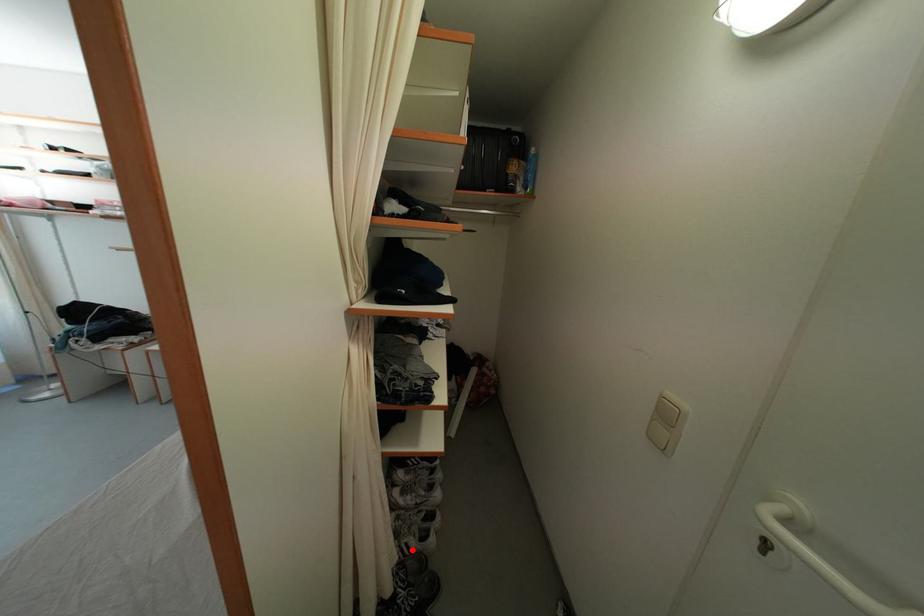
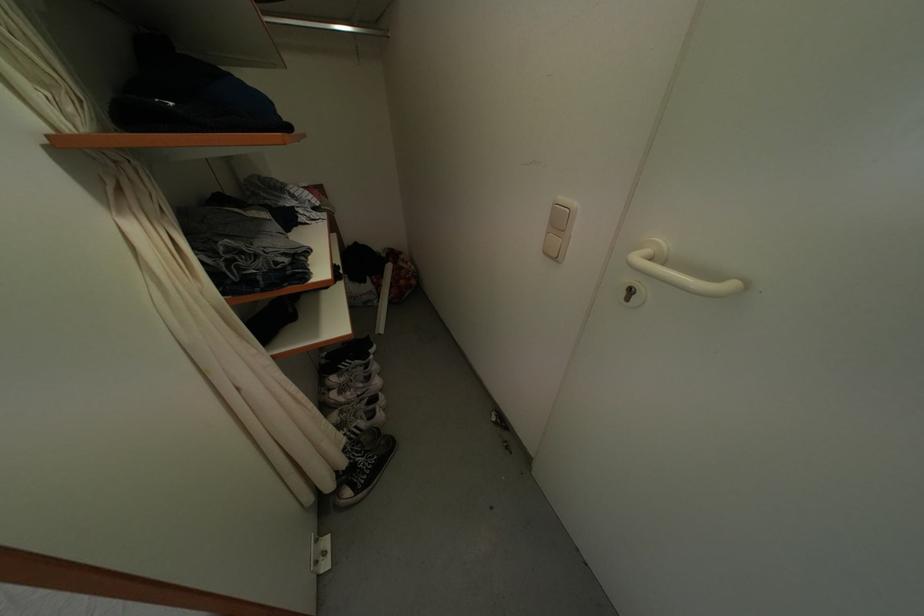
Question: I am providing you with two images of the same scene from different viewpoints. Image1 has a red point marked. In image2, the corresponding 3D location appears at what relative position? Reply with the corresponding letter.

Choices:
 (A) Closer
 (B) Farther

Answer: (B)